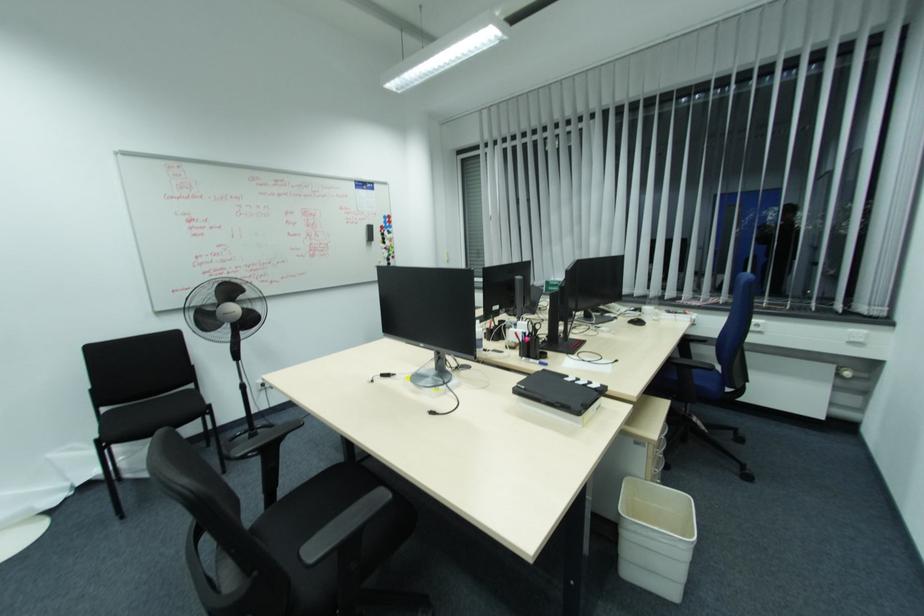
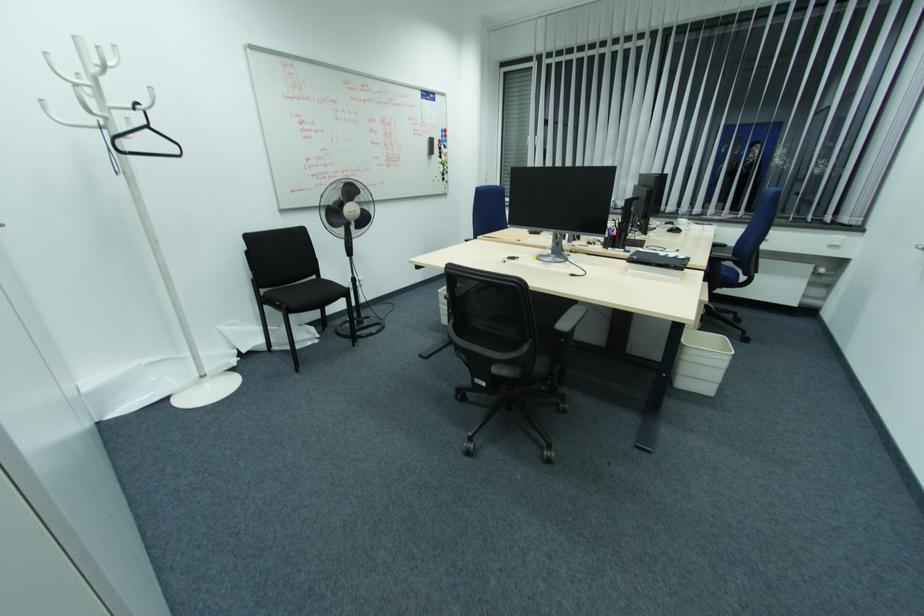
Locate, in the second image, the point that corresponds to [698,383] in the first image.

(723, 273)